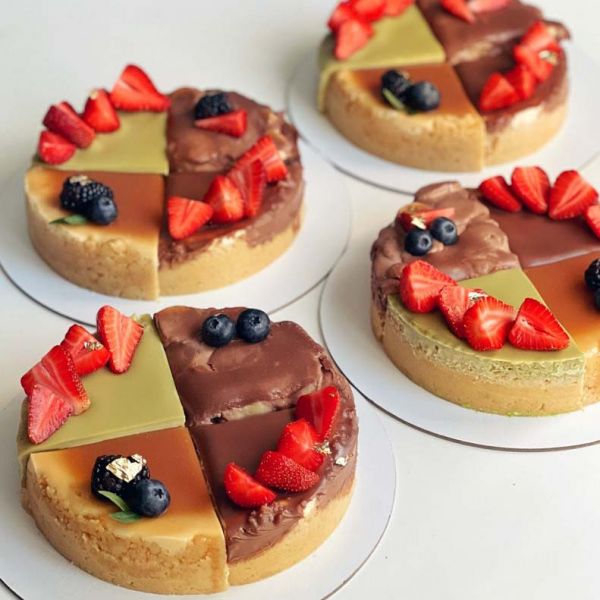
Where is `paper plates`? Image resolution: width=600 pixels, height=600 pixels. paper plates is located at coordinates (381, 471), (394, 382), (312, 283), (351, 163).